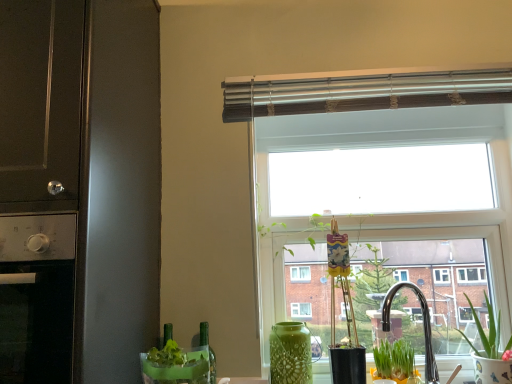
Question: Should I look upward or downward to see green glass bottle at lower center?

Choices:
 (A) up
 (B) down

Answer: (B)

Question: Considering the relative sizes of transparent glass window at center and green matte plant at lower right, arranged as the 1th houseplant when viewed from the left, in the image provided, is transparent glass window at center bigger than green matte plant at lower right, arranged as the 1th houseplant when viewed from the left,?

Choices:
 (A) no
 (B) yes

Answer: (B)

Question: Does transparent glass window at center appear on the left side of green matte plant at lower right, which is the 2th houseplant in right-to-left order?

Choices:
 (A) no
 (B) yes

Answer: (A)

Question: Is transparent glass window at center to the right of green matte plant at lower right, which is the 2th houseplant in right-to-left order, from the viewer's perspective?

Choices:
 (A) no
 (B) yes

Answer: (B)

Question: Does transparent glass window at center turn towards green matte plant at lower right, which is the 2th houseplant in right-to-left order?

Choices:
 (A) no
 (B) yes

Answer: (B)

Question: Would you say transparent glass window at center is a long distance from green matte plant at lower right, arranged as the 1th houseplant when viewed from the left?

Choices:
 (A) yes
 (B) no

Answer: (B)

Question: From the image's perspective, does transparent glass window at center appear higher than green matte plant at lower right, arranged as the 1th houseplant when viewed from the left?

Choices:
 (A) no
 (B) yes

Answer: (B)

Question: Is stainless steel oven at left, the first appliance when ordered from bottom to top, taller than green glass bottle at lower center?

Choices:
 (A) yes
 (B) no

Answer: (A)

Question: Is stainless steel oven at left, the first appliance when ordered from bottom to top, not within green glass bottle at lower center?

Choices:
 (A) yes
 (B) no

Answer: (A)

Question: Can you confirm if stainless steel oven at left, which appears as the second appliance when viewed from the top, is wider than green glass bottle at lower center?

Choices:
 (A) no
 (B) yes

Answer: (B)

Question: Is stainless steel oven at left, which appears as the second appliance when viewed from the top, thinner than green glass bottle at lower center?

Choices:
 (A) yes
 (B) no

Answer: (B)

Question: Considering the relative positions of stainless steel oven at left, which appears as the second appliance when viewed from the top, and green glass bottle at lower center in the image provided, is stainless steel oven at left, which appears as the second appliance when viewed from the top, to the left of green glass bottle at lower center from the viewer's perspective?

Choices:
 (A) no
 (B) yes

Answer: (B)

Question: Considering the relative sizes of stainless steel oven at left, the first appliance when ordered from bottom to top, and green glass bottle at lower center in the image provided, is stainless steel oven at left, the first appliance when ordered from bottom to top, bigger than green glass bottle at lower center?

Choices:
 (A) no
 (B) yes

Answer: (B)

Question: Considering the relative positions of transparent glass window at center and green ceramic pot at lower right, the 2th houseplant viewed from the left, in the image provided, is transparent glass window at center behind green ceramic pot at lower right, the 2th houseplant viewed from the left,?

Choices:
 (A) no
 (B) yes

Answer: (B)